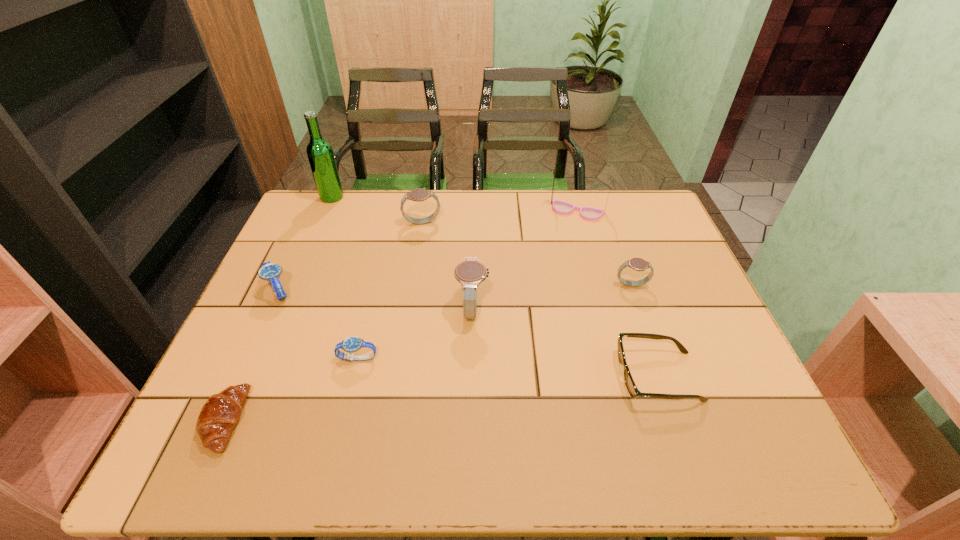
Locate an element on the screen. vacant area that lies between the second watch from right to left and the rightmost gray watch is located at coordinates (552, 297).

Where is `free spot between the shorter spectacles and the farther spectacles`? free spot between the shorter spectacles and the farther spectacles is located at coordinates (617, 294).

This screenshot has height=540, width=960. What are the coordinates of `free space that is in between the fourth watch from left to right and the farther spectacles` in the screenshot? It's located at (524, 260).

Where is `object that ranks as the sixth closest to the crescent roll`? The width and height of the screenshot is (960, 540). object that ranks as the sixth closest to the crescent roll is located at coordinates (630, 384).

Select which object appears as the fourth closest to the right blue watch. Please provide its 2D coordinates. Your answer should be formatted as a tuple, i.e. [(x, y)], where the tuple contains the x and y coordinates of a point satisfying the conditions above.

[(420, 194)]

The image size is (960, 540). What are the coordinates of `watch that can be found as the closest to the brown crescent roll` in the screenshot? It's located at (351, 344).

You are a GUI agent. You are given a task and a screenshot of the screen. Output one action in this format:
    pyautogui.click(x=<x>, y=<y>)
    Task: Click on the closest watch to the crescent roll
    
    Given the screenshot: What is the action you would take?
    pyautogui.click(x=351, y=344)

Locate an element on the screen. This screenshot has height=540, width=960. the second closest gray watch to the tallest object is located at coordinates (470, 272).

Identify the location of gray watch that is the third closest to the beer bottle. This screenshot has width=960, height=540. (638, 264).

This screenshot has height=540, width=960. I want to click on free point that satisfies the following two spatial constraints: 1. on the back side of the smaller blue watch; 2. on the left side of the leftmost gray watch, so click(391, 222).